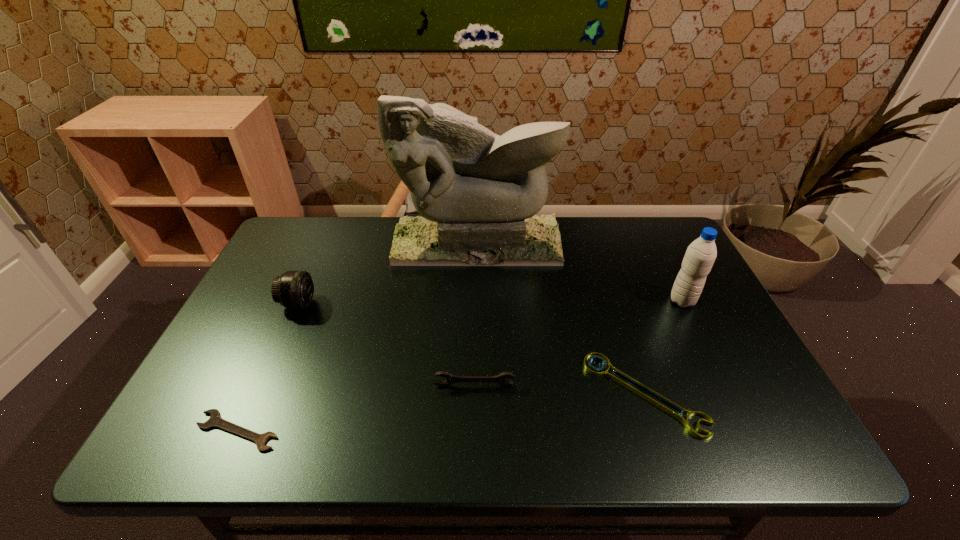
Where is `the second closest object relative to the shortest object`? the second closest object relative to the shortest object is located at coordinates (450, 379).

This screenshot has height=540, width=960. Identify the location of the closest wrench to the second tallest object. (666, 405).

The image size is (960, 540). What are the coordinates of `wrench identified as the third closest to the tallest object` in the screenshot? It's located at (215, 420).

Locate an element on the screen. free space in the image that satisfies the following two spatial constraints: 1. on the base of the second shortest object; 2. on the left side of the tallest object is located at coordinates (476, 394).

I want to click on vacant point that satisfies the following two spatial constraints: 1. on the front-facing side of the telephoto lens; 2. on the back side of the second tallest wrench, so click(x=258, y=394).

Find the location of a particular element. This screenshot has height=540, width=960. vacant space that satisfies the following two spatial constraints: 1. on the base of the farthest object; 2. on the front-facing side of the third tallest object is located at coordinates (476, 303).

This screenshot has width=960, height=540. I want to click on blank space that satisfies the following two spatial constraints: 1. on the base of the rightmost wrench; 2. on the left side of the farthest object, so click(x=476, y=394).

Where is `vacant region that satisfies the following two spatial constraints: 1. on the front side of the second tallest object; 2. on the front-facing side of the fourth shortest object`? Image resolution: width=960 pixels, height=540 pixels. vacant region that satisfies the following two spatial constraints: 1. on the front side of the second tallest object; 2. on the front-facing side of the fourth shortest object is located at coordinates click(x=684, y=303).